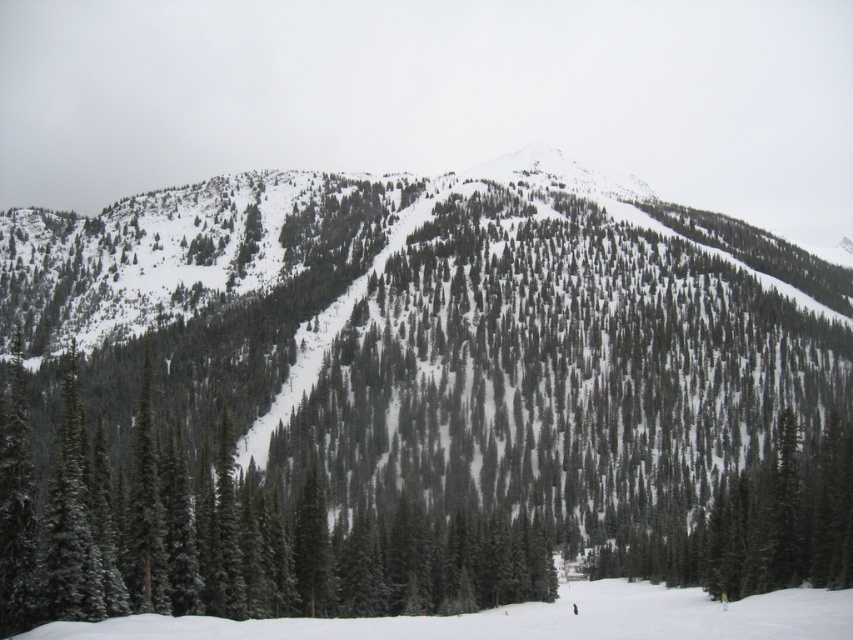
Question: Can you confirm if green textured pine at center is bigger than green textured pine tree at center?

Choices:
 (A) yes
 (B) no

Answer: (A)

Question: Is green textured pine at center positioned in front of green textured pine tree at center?

Choices:
 (A) yes
 (B) no

Answer: (B)

Question: Which of the following is the closest to the observer?

Choices:
 (A) (582, 531)
 (B) (13, 436)

Answer: (B)

Question: Does green textured pine at center have a larger size compared to green textured pine tree at center?

Choices:
 (A) no
 (B) yes

Answer: (B)